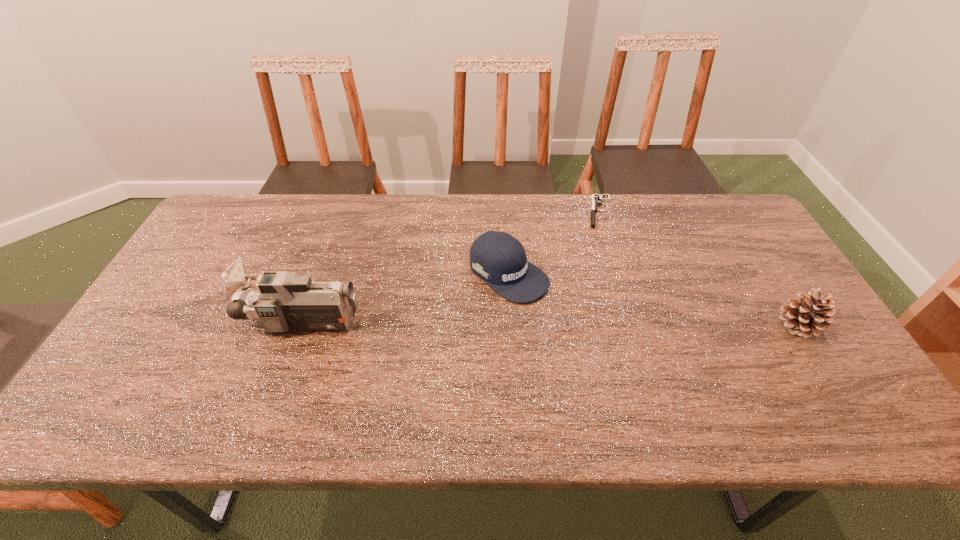
Where is `vacant area that lies between the second shortest object and the third object from left to right`? Image resolution: width=960 pixels, height=540 pixels. vacant area that lies between the second shortest object and the third object from left to right is located at coordinates (554, 243).

Find the location of a particular element. This screenshot has height=540, width=960. vacant region between the tallest object and the farthest object is located at coordinates (451, 267).

Where is `vacant region between the tallest object and the rightmost object`? The height and width of the screenshot is (540, 960). vacant region between the tallest object and the rightmost object is located at coordinates (551, 323).

Locate an element on the screen. Image resolution: width=960 pixels, height=540 pixels. vacant region between the second shortest object and the rightmost object is located at coordinates (654, 300).

Select which object appears as the third closest to the rightmost object. Please provide its 2D coordinates. Your answer should be formatted as a tuple, i.e. [(x, y)], where the tuple contains the x and y coordinates of a point satisfying the conditions above.

[(286, 301)]

Find the location of a particular element. This screenshot has width=960, height=540. object that is the nearest to the third tallest object is located at coordinates (596, 200).